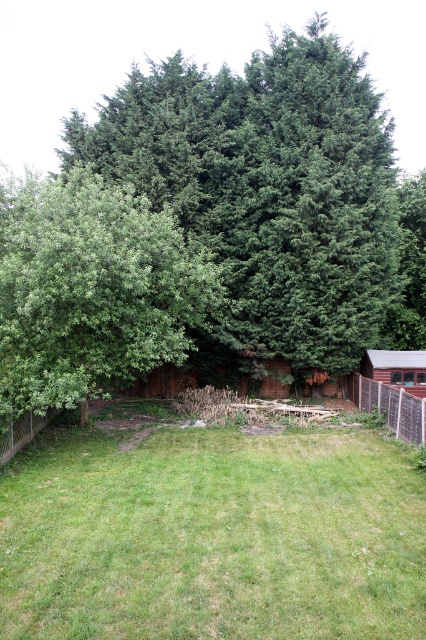
Based on the photo, you are a gardener who needs to mow the lawn. You see the green grass at center and the green leafy tree at upper center. Which one is closer to the ground?

The green grass at center is shorter than the green leafy tree at upper center, so the green grass at center is closer to the ground.

You are planning to install a new garden bed in your backyard. You have two options for locations based on the image provided. The first option is near the green grass at center, and the second is near the wooden fence at lower left. Which location offers more space for the garden bed?

The green grass at center is larger in size than the wooden fence at lower left, so the location near the green grass at center offers more space for the garden bed.

From the picture: You are standing in the backyard and want to take a photo of the green leafy tree at left and the wooden fence at lower left. Which object should you frame first in your camera viewfinder to ensure both are in the shot?

You should frame the wooden fence at lower left first because the green leafy tree at left is positioned on the right side of it, so starting with the fence ensures both are included in the viewfinder.